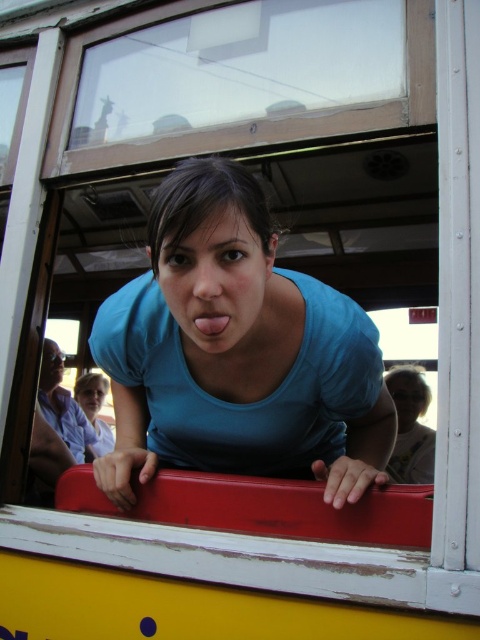
Question: Is blue matte shirt at center above matte blue shirt at center?

Choices:
 (A) no
 (B) yes

Answer: (B)

Question: From the image, what is the correct spatial relationship of matte blue shirt at center in relation to pink glossy tongue at center?

Choices:
 (A) right
 (B) left

Answer: (A)

Question: Which of the following is the closest to the observer?

Choices:
 (A) tap(406, 438)
 (B) tap(237, 310)

Answer: (B)

Question: Does blue matte shirt at center have a smaller size compared to matte blue shirt at center?

Choices:
 (A) yes
 (B) no

Answer: (B)

Question: Which object is closer to the camera taking this photo?

Choices:
 (A) pink glossy tongue at center
 (B) blue matte shirt at center

Answer: (B)

Question: Which of the following is the closest to the observer?

Choices:
 (A) matte blue shirt at center
 (B) blue matte shirt at center

Answer: (B)